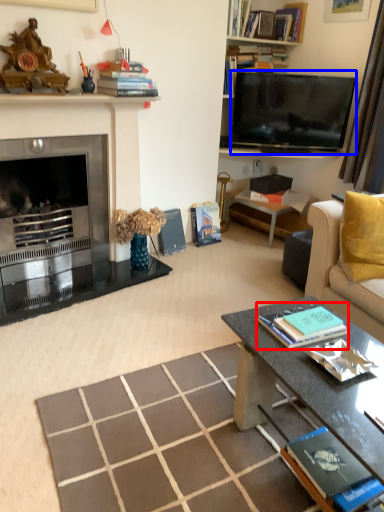
Question: Among these objects, which one is farthest to the camera, book (highlighted by a red box) or television (highlighted by a blue box)?

Choices:
 (A) book
 (B) television

Answer: (B)